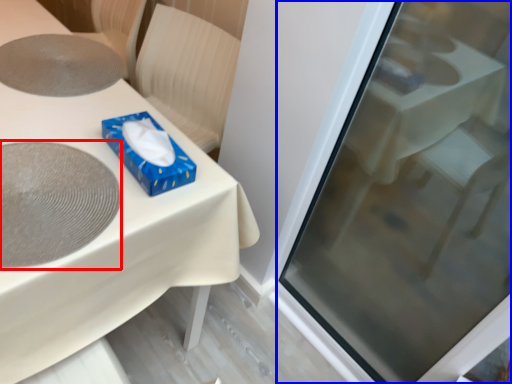
Question: Which object appears closest to the camera in this image, oval (highlighted by a red box) or screen door (highlighted by a blue box)?

Choices:
 (A) oval
 (B) screen door

Answer: (B)